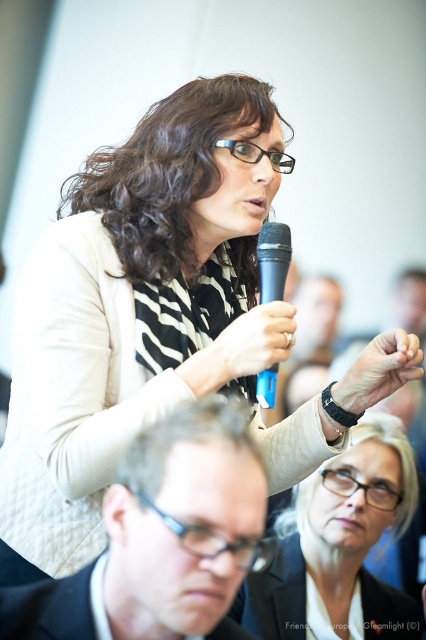
Is matte black jacket at center bigger than black plastic microphone at center?

Correct, matte black jacket at center is larger in size than black plastic microphone at center.

Which is more to the right, matte black jacket at center or black plastic microphone at center?

matte black jacket at center is more to the right.

Is point (316, 586) positioned after point (267, 403)?

That is True.

Locate an element on the screen. matte black jacket at center is located at coordinates (336, 548).

Who is more forward, (400, 449) or (224, 333)?

Positioned in front is point (224, 333).

Who is lower down, matte black jacket at center or white matte microphone at center?

matte black jacket at center is below.

You are a GUI agent. You are given a task and a screenshot of the screen. Output one action in this format:
    pyautogui.click(x=<x>, y=<y>)
    Task: Click on the matte black jacket at center
    This screenshot has height=640, width=426.
    Given the screenshot: What is the action you would take?
    pyautogui.click(x=336, y=548)

Is point (379, 340) farther from viewer compared to point (279, 288)?

That is True.

Does black leather wristwatch at center come in front of black plastic microphone at center?

That is True.

Does point (377, 394) come farther from viewer compared to point (261, 300)?

Yes, it is.

I want to click on black leather wristwatch at center, so click(379, 369).